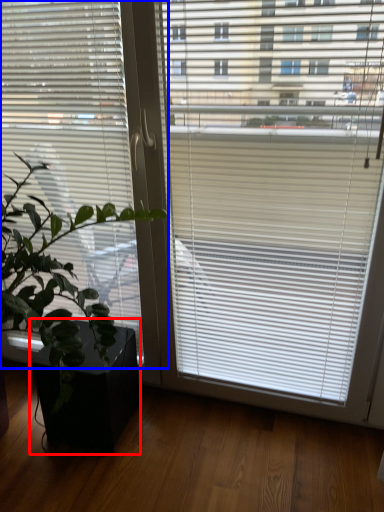
Question: Which object appears farthest to the camera in this image, flowerpot (highlighted by a red box) or window blind (highlighted by a blue box)?

Choices:
 (A) flowerpot
 (B) window blind

Answer: (A)